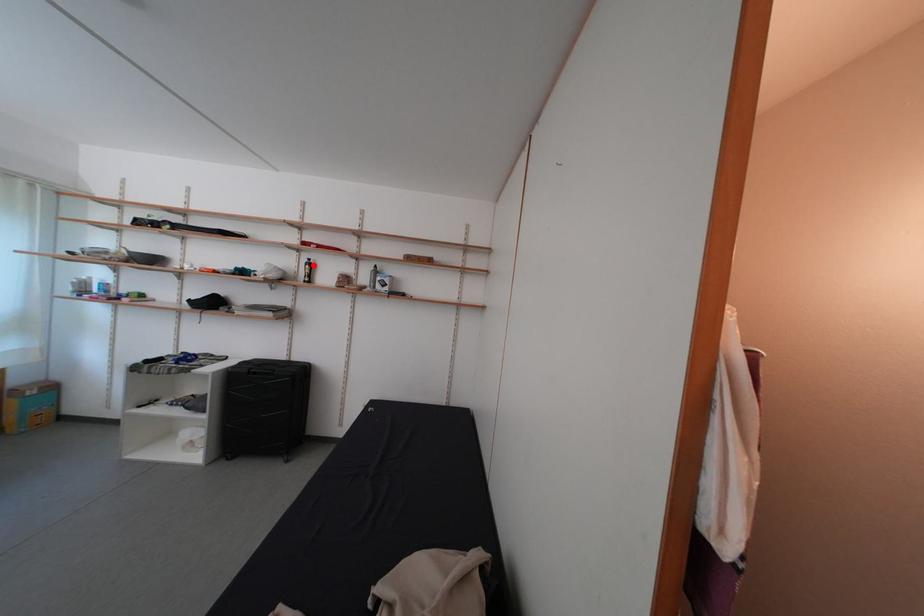
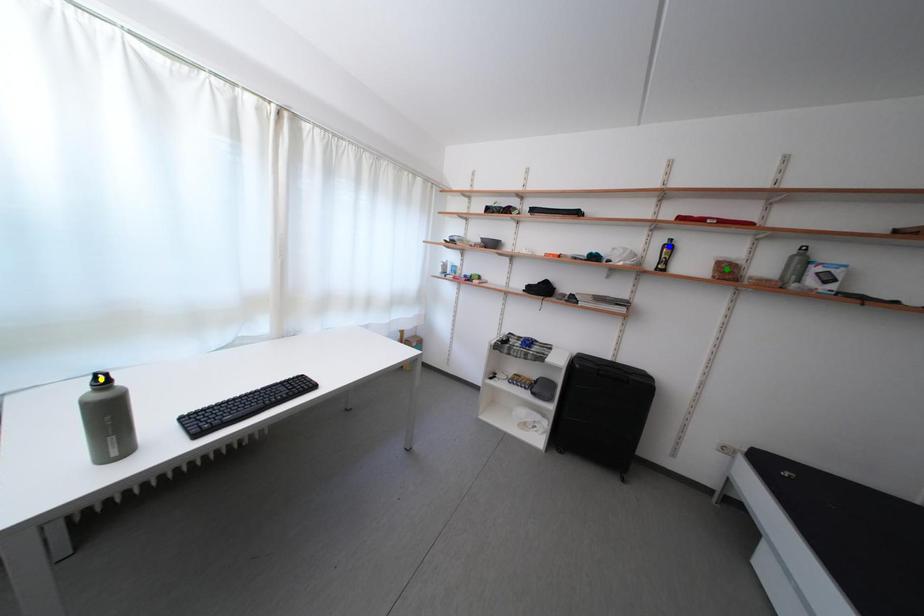
Question: I am providing you with two images of the same scene from different viewpoints. A red point is marked on the first image. You are given multiple points on the second image. Can you choose the point in image 2 that corresponds to the point in image 1?

Choices:
 (A) yellow point
 (B) green point
 (C) blue point

Answer: (C)